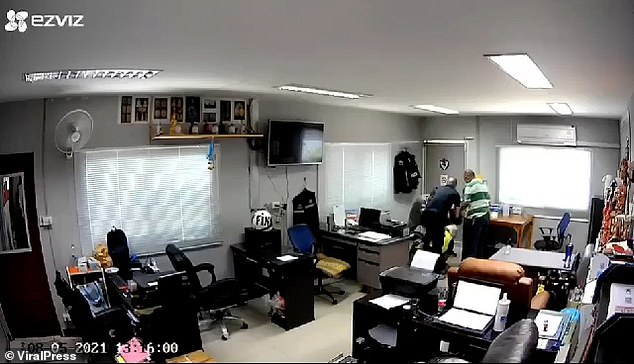
At what (x,y) coordinates should I click in order to perform the action: click on printer. Please return your answer as a coordinate pair (x, y). Looking at the image, I should click on (406, 279).